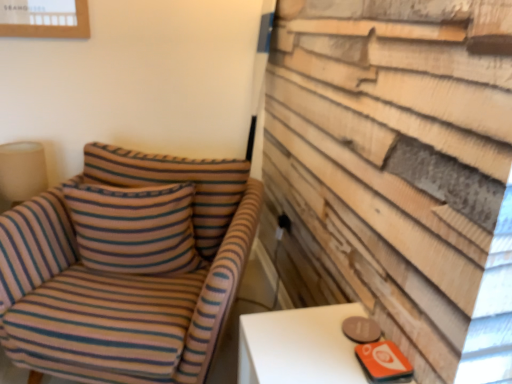
Question: Is black plastic outlet at center-right inside or outside of beige fabric lampshade at left?

Choices:
 (A) outside
 (B) inside

Answer: (A)

Question: Based on their positions, is black plastic outlet at center-right located to the left or right of beige fabric lampshade at left?

Choices:
 (A) right
 (B) left

Answer: (A)

Question: Considering the real-world distances, which object is closest to the beige fabric lampshade at left?

Choices:
 (A) striped fabric pillow at center
 (B) striped fabric chair at left
 (C) black plastic outlet at center-right

Answer: (A)

Question: Based on their relative distances, which object is farther from the black plastic outlet at center-right?

Choices:
 (A) striped fabric pillow at center
 (B) beige fabric lampshade at left
 (C) striped fabric chair at left

Answer: (B)